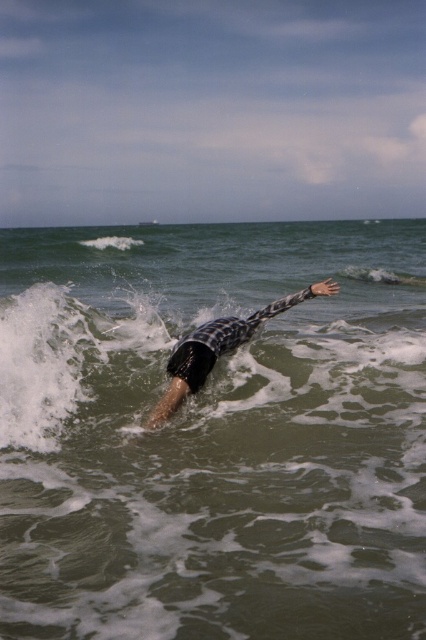
You are a photographer trying to capture the swimmer in the ocean. You need to know if the greenish water at center will cover the entire black checkered wetsuit at center in your shot. Can you determine this based on their widths?

The greenish water at center is wider than the black checkered wetsuit at center, so it will cover the entire black checkered wetsuit at center in the shot.

You are a lifeguard on duty and notice a swimmer in the ocean. You see the greenish water at center and the black checkered wetsuit at center. Which object is located above the other?

The greenish water at center is positioned over the black checkered wetsuit at center, meaning the water is above the wetsuit.

You are a photographer trying to capture the swimmer in the ocean. You notice two points marked in the image at coordinates point (x=322, y=381) and point (x=195, y=381). Which point is closer to the photographer?

Point (x=195, y=381) is closer to the photographer because it is in front of point (x=322, y=381).